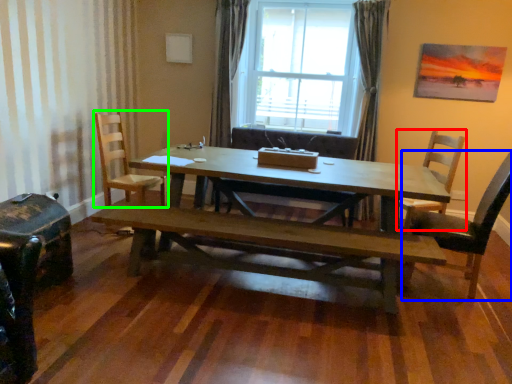
Question: Which object is positioned farthest from chair (highlighted by a red box)? Select from chair (highlighted by a blue box) and chair (highlighted by a green box).

Choices:
 (A) chair
 (B) chair

Answer: (B)